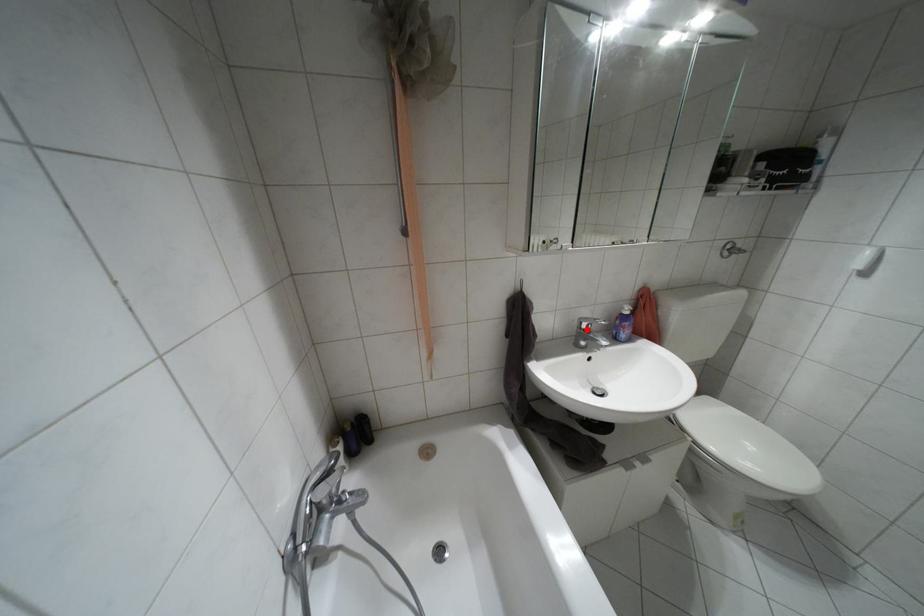
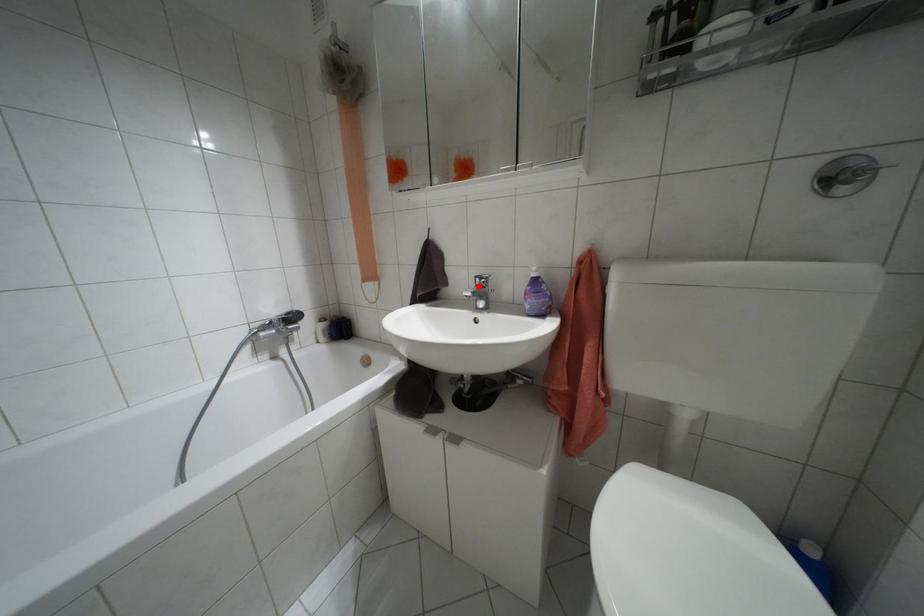
I am providing you with two images of the same scene from different viewpoints. A red point is marked on the first image and another point is marked on the second image. Is the marked point in image1 the same physical position as the marked point in image2?

Yes